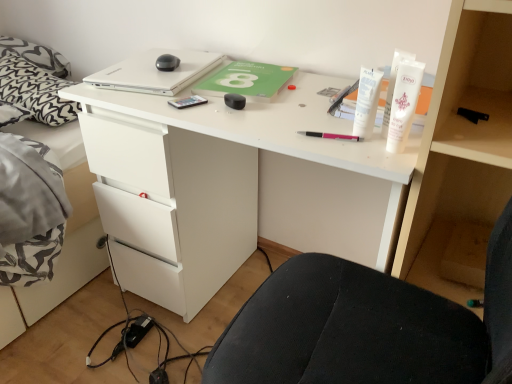
This screenshot has width=512, height=384. What are the coordinates of `vacant area to the left of white matte tube at upper right, the 1th toiletry in the left-to-right sequence` in the screenshot? It's located at (289, 129).